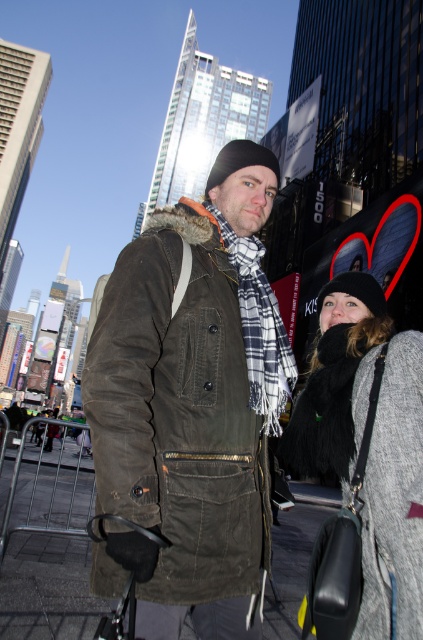
Question: Does olive-green waxed canvas jacket at center appear on the right side of olive corduroy jacket at center?

Choices:
 (A) yes
 (B) no

Answer: (A)

Question: Which point appears farthest from the camera in this image?

Choices:
 (A) (227, 147)
 (B) (348, 372)

Answer: (A)

Question: Can you confirm if olive-green waxed canvas jacket at center is positioned above olive corduroy jacket at center?

Choices:
 (A) no
 (B) yes

Answer: (B)

Question: Which of the following is the closest to the observer?

Choices:
 (A) (131, 244)
 (B) (258, 371)

Answer: (A)

Question: Which of these objects is positioned closest to the gray woolen sweater at right?

Choices:
 (A) olive corduroy jacket at center
 (B) olive-green waxed canvas jacket at center

Answer: (B)

Question: Can you confirm if olive corduroy jacket at center is bigger than gray woolen sweater at right?

Choices:
 (A) yes
 (B) no

Answer: (B)